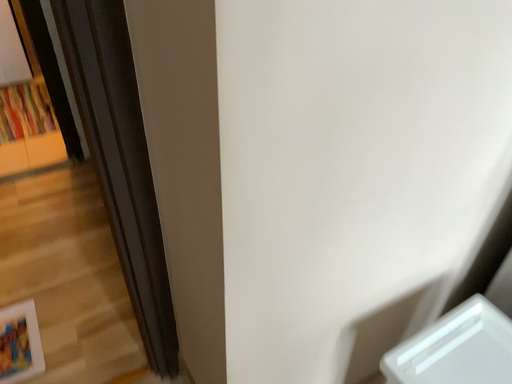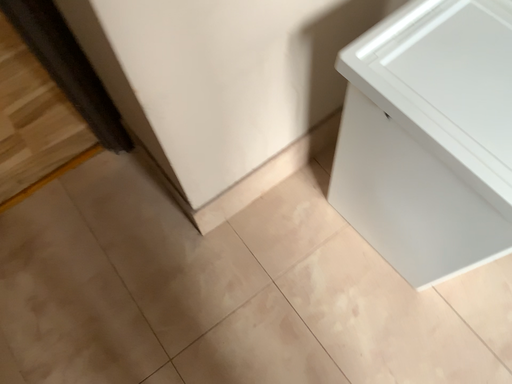
Question: Which way did the camera rotate in the video?

Choices:
 (A) rotated upward
 (B) rotated downward

Answer: (B)